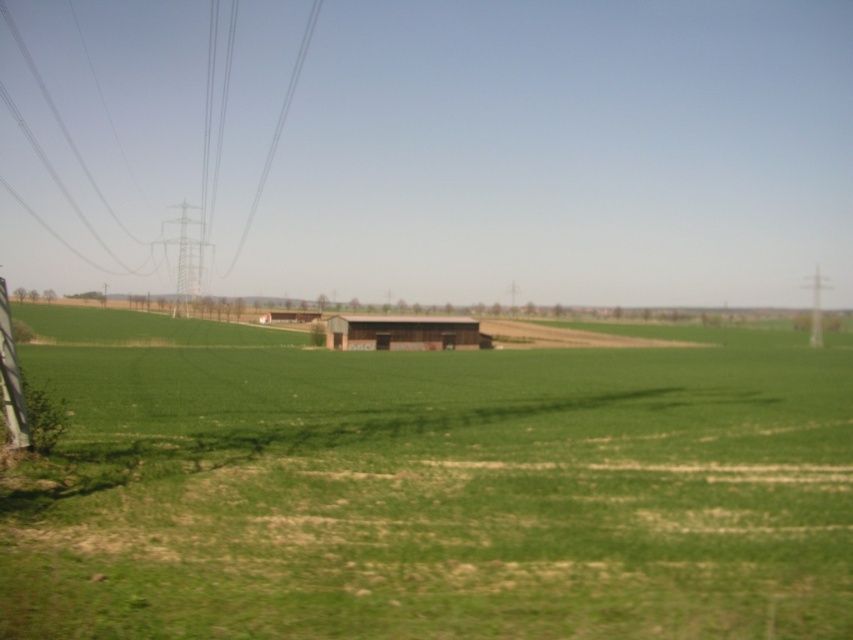
Question: From the image, what is the correct spatial relationship of green grassy field at center in relation to metallic wire at left?

Choices:
 (A) left
 (B) right

Answer: (B)

Question: Does green grassy field at center have a larger size compared to metallic wire at left?

Choices:
 (A) no
 (B) yes

Answer: (A)

Question: Does green grassy field at center have a lesser width compared to metallic wire at left?

Choices:
 (A) yes
 (B) no

Answer: (A)